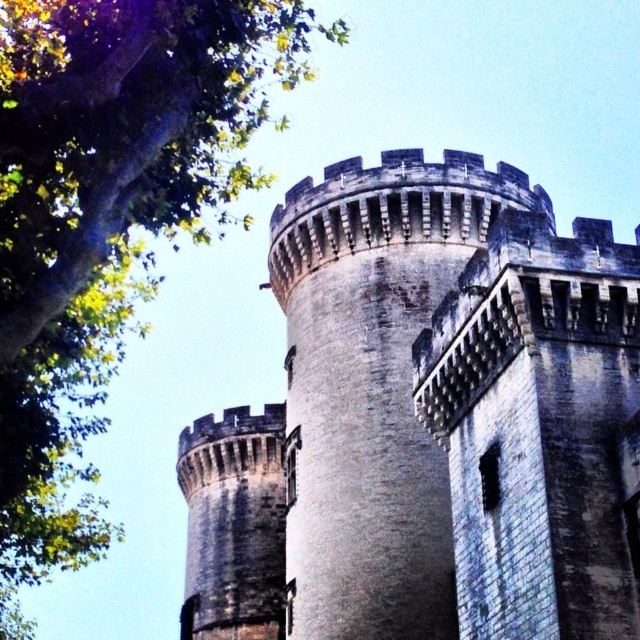
Where is `gray stone castle at center`? The width and height of the screenshot is (640, 640). gray stone castle at center is located at coordinates click(428, 420).

Is gray stone castle at center above green leafy tree at upper left?

Actually, gray stone castle at center is below green leafy tree at upper left.

Is point (280, 208) farther from viewer compared to point (90, 220)?

Yes, point (280, 208) is behind point (90, 220).

You are a GUI agent. You are given a task and a screenshot of the screen. Output one action in this format:
    pyautogui.click(x=<x>, y=<y>)
    Task: Click on the gray stone castle at center
    Image resolution: width=640 pixels, height=640 pixels.
    Given the screenshot: What is the action you would take?
    pyautogui.click(x=428, y=420)